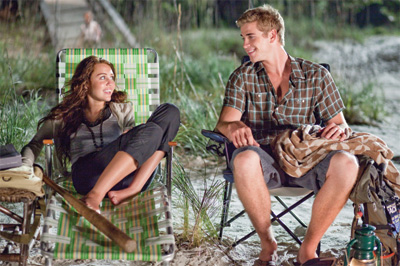
Locate an element on the screen. recliner lounger is located at coordinates (141, 70).